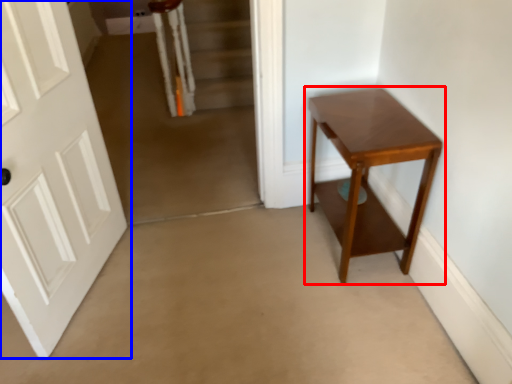
Question: Which object appears farthest to the camera in this image, table (highlighted by a red box) or door (highlighted by a blue box)?

Choices:
 (A) table
 (B) door

Answer: (A)